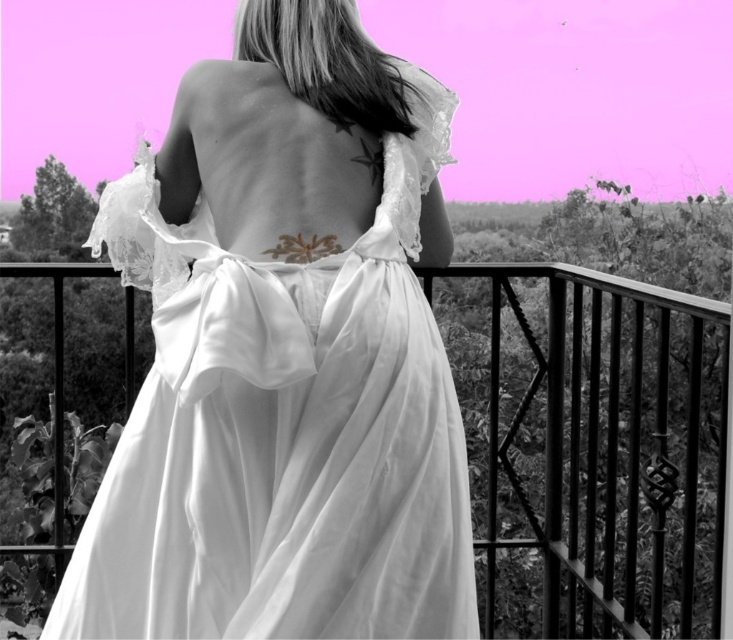
You are a fashion designer observing the image. You need to determine if the satin dress at center can be displayed on a mannequin placed on the metallic black balcony at center. The mannequin requires at least 10 cm of space between the dress and the balcony edge for safety. Can the dress be displayed safely?

The satin dress at center is thinner than the metallic black balcony at center. Since the dress is thinner, it would require less space, so there is enough room to display it safely with the required 10 cm clearance.

You are a photographer positioned at point [383,192]. You want to capture a closeup shot of the person on the balcony. The camera has a focal length of 50mm. What is the minimum distance you need to be from the subject to achieve this shot?

The minimum distance required is 2.48 meters.